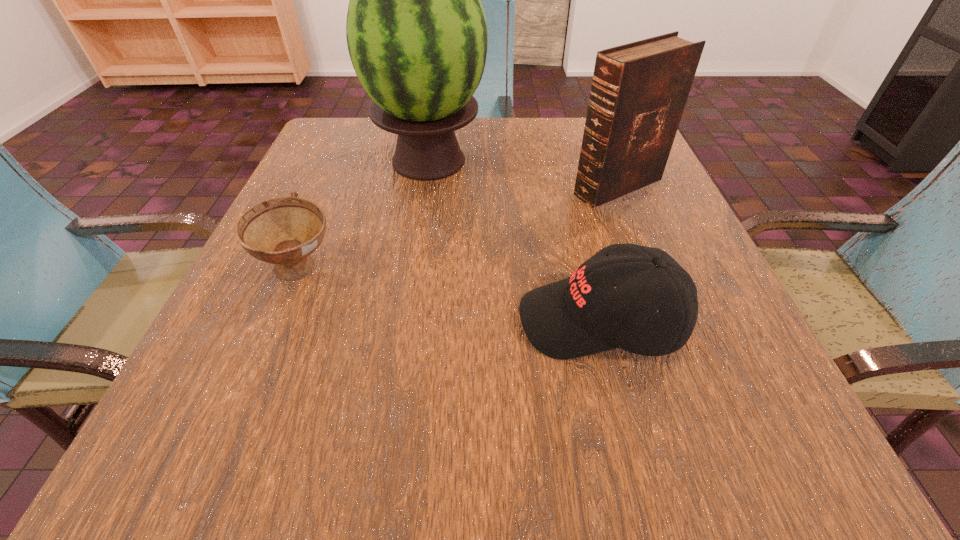
I want to click on the tallest object, so click(416, 31).

Locate an element on the screen. The width and height of the screenshot is (960, 540). the second tallest object is located at coordinates click(639, 90).

Image resolution: width=960 pixels, height=540 pixels. Find the location of `baseball cap`. baseball cap is located at coordinates (581, 315).

Image resolution: width=960 pixels, height=540 pixels. Identify the location of soup bowl. (284, 231).

Find the location of a particular element. This screenshot has width=960, height=540. free space located on the right of the tallest object is located at coordinates (649, 161).

Where is `free space located 0.390m on the front of the Bible`? The image size is (960, 540). free space located 0.390m on the front of the Bible is located at coordinates (699, 393).

Find the location of `vacant point located 0.290m on the front-facing side of the baseball cap`. vacant point located 0.290m on the front-facing side of the baseball cap is located at coordinates (318, 321).

Identify the location of free region located on the front-facing side of the baseball cap. The image size is (960, 540). (249, 321).

The height and width of the screenshot is (540, 960). I want to click on free space located 0.140m on the front-facing side of the baseball cap, so click(x=421, y=321).

In order to click on vacant space located 0.160m on the right of the soup bowl in this screenshot , I will do `click(437, 271)`.